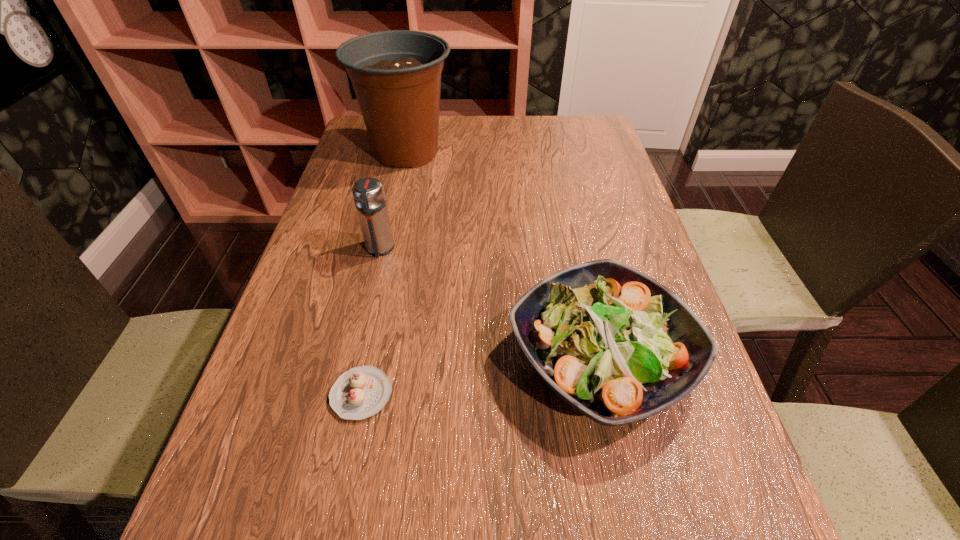
Identify the location of vacant space positioned on the right of the cupcake. The height and width of the screenshot is (540, 960). (619, 394).

Find the location of a particular element. object located in the far edge section of the desktop is located at coordinates (396, 75).

Locate an element on the screen. Image resolution: width=960 pixels, height=540 pixels. flowerpot situated at the left edge is located at coordinates (396, 75).

This screenshot has width=960, height=540. In order to click on thermos bottle located at the left edge in this screenshot , I will do tap(368, 193).

In order to click on cupcake present at the left edge in this screenshot , I will do `click(361, 392)`.

You are a GUI agent. You are given a task and a screenshot of the screen. Output one action in this format:
    pyautogui.click(x=<x>, y=<y>)
    Task: Click on the object at the right edge
    
    Given the screenshot: What is the action you would take?
    pyautogui.click(x=615, y=344)

This screenshot has height=540, width=960. I want to click on object at the far left corner, so click(396, 75).

In the image, there is a desktop. Where is `free space at the far edge`? This screenshot has width=960, height=540. free space at the far edge is located at coordinates (530, 151).

The image size is (960, 540). I want to click on free location at the left edge of the desktop, so click(x=358, y=269).

In the image, there is a desktop. Identify the location of vacant space at the right edge. The height and width of the screenshot is (540, 960). (646, 247).